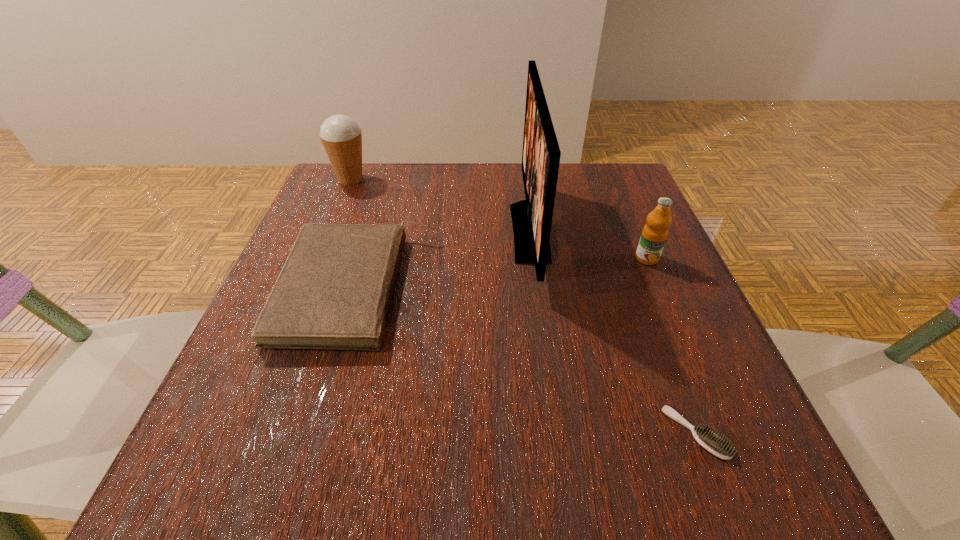
At what (x,y) coordinates should I click in order to perform the action: click on object that is the fourth closest to the paperback book. Please return your answer as a coordinate pair (x, y). Looking at the image, I should click on (655, 232).

This screenshot has width=960, height=540. I want to click on blank space that satisfies the following two spatial constraints: 1. on the back side of the shortest object; 2. on the spine side of the fourth tallest object, so click(x=640, y=288).

What are the coordinates of `free space that satisfies the following two spatial constraints: 1. on the label of the orange juice; 2. on the spine side of the fourth tallest object` in the screenshot? It's located at (660, 288).

Identify the location of vacant space that satisfies the following two spatial constraints: 1. on the front-facing side of the monitor; 2. on the back side of the nearest object. (557, 433).

The image size is (960, 540). I want to click on free space that satisfies the following two spatial constraints: 1. on the label of the third tallest object; 2. on the spine side of the paperback book, so click(x=660, y=288).

Find the location of a particular element. Image resolution: width=960 pixels, height=540 pixels. vacant space that satisfies the following two spatial constraints: 1. on the front-facing side of the monitor; 2. on the back side of the nearest object is located at coordinates (557, 433).

You are a GUI agent. You are given a task and a screenshot of the screen. Output one action in this format:
    pyautogui.click(x=<x>, y=<y>)
    Task: Click on the vacant space that satisfies the following two spatial constraints: 1. on the spine side of the shortest object; 2. on the left side of the paperback book
    This screenshot has height=540, width=960.
    Given the screenshot: What is the action you would take?
    pyautogui.click(x=317, y=433)